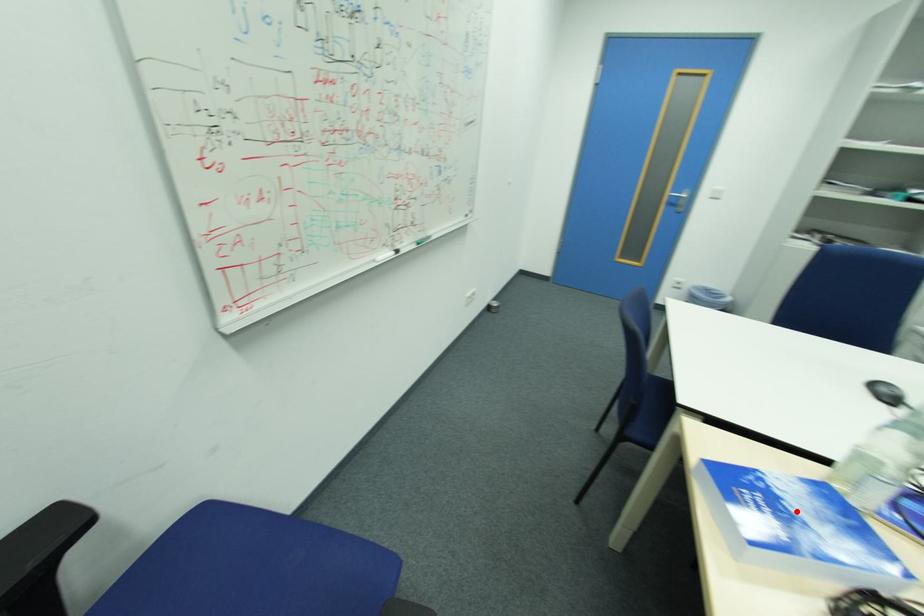
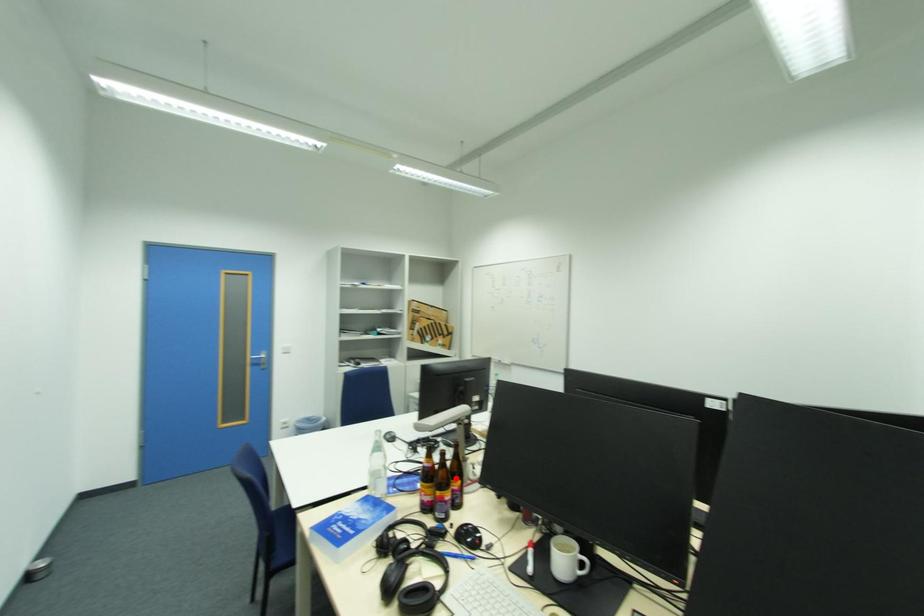
I am providing you with two images of the same scene from different viewpoints. A red point is marked on the first image and another point is marked on the second image. Do the highlighted points in image1 and image2 indicate the same real-world spot?

No